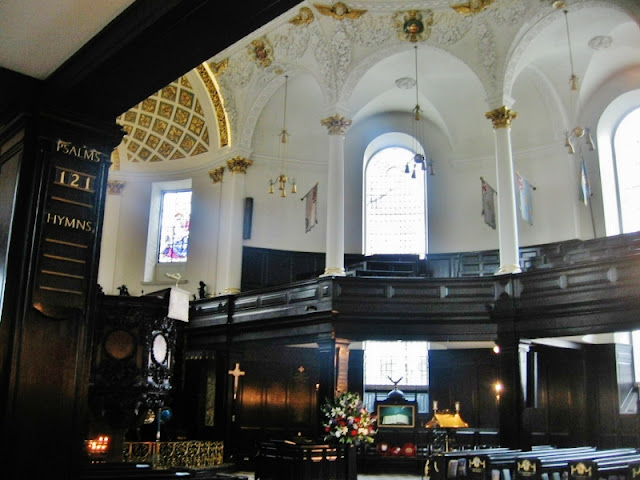
In order to click on vaulted ceiling in this screenshot , I will do 163,109.